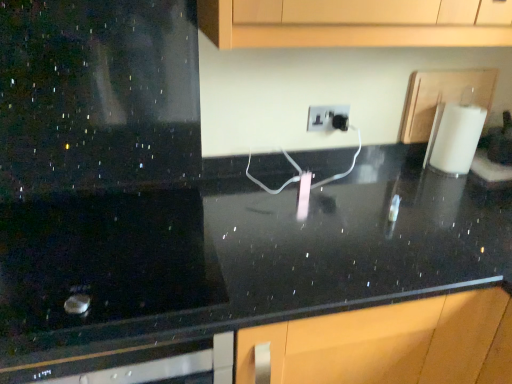
Where is `vacant space situated above black polished countertop at center (from a real-world perspective)`? This screenshot has width=512, height=384. vacant space situated above black polished countertop at center (from a real-world perspective) is located at coordinates (279, 225).